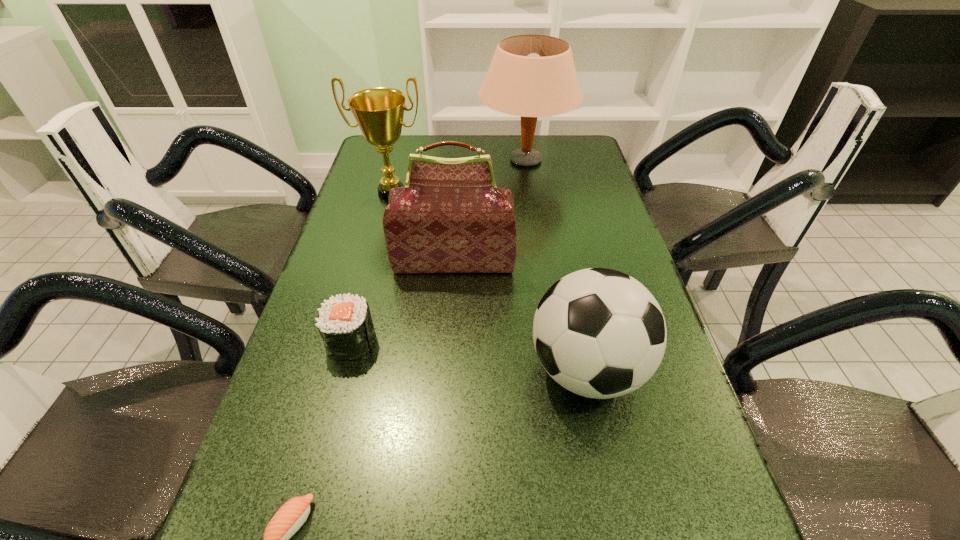
You are a GUI agent. You are given a task and a screenshot of the screen. Output one action in this format:
    pyautogui.click(x=<x>, y=<y>)
    Task: Click on the vacant space that satisfies the following two spatial constraints: 1. on the front-facing side of the soccer ball; 2. on the left side of the handbag
    This screenshot has height=540, width=960.
    Given the screenshot: What is the action you would take?
    pyautogui.click(x=447, y=369)

I want to click on vacant point that satisfies the following two spatial constraints: 1. on the front-facing side of the lampshade; 2. on the front-facing side of the fourth nearest object, so click(540, 262).

Identify the location of vacant area that satisfies the following two spatial constraints: 1. on the front side of the soccer ball; 2. on the right side of the taller sushi. This screenshot has height=540, width=960. (343, 369).